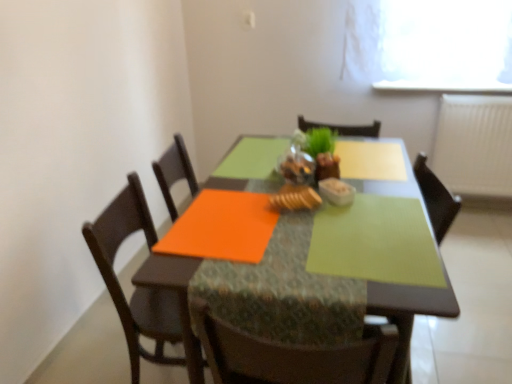
Question: Would you consider wooden chair at left to be distant from baked golden bread at center?

Choices:
 (A) no
 (B) yes

Answer: (A)

Question: Is wooden chair at left oriented towards baked golden bread at center?

Choices:
 (A) yes
 (B) no

Answer: (A)

Question: From the image's perspective, does wooden chair at left appear lower than baked golden bread at center?

Choices:
 (A) yes
 (B) no

Answer: (A)

Question: Can you confirm if wooden chair at left is positioned to the left of baked golden bread at center?

Choices:
 (A) no
 (B) yes

Answer: (B)

Question: From the image's perspective, is wooden chair at left located above baked golden bread at center?

Choices:
 (A) yes
 (B) no

Answer: (B)

Question: In the image, is white textured radiator at right positioned in front of or behind green matte placemat at center?

Choices:
 (A) behind
 (B) front

Answer: (A)

Question: From a real-world perspective, is white textured radiator at right above or below green matte placemat at center?

Choices:
 (A) above
 (B) below

Answer: (A)

Question: In terms of height, does white textured radiator at right look taller or shorter compared to green matte placemat at center?

Choices:
 (A) tall
 (B) short

Answer: (B)

Question: Based on their sizes in the image, would you say white textured radiator at right is bigger or smaller than green matte placemat at center?

Choices:
 (A) small
 (B) big

Answer: (A)

Question: Is green matte placemat at center inside the boundaries of white textured radiator at right, or outside?

Choices:
 (A) outside
 (B) inside

Answer: (A)

Question: Is green matte placemat at center bigger or smaller than white textured radiator at right?

Choices:
 (A) small
 (B) big

Answer: (B)

Question: Is point (384, 309) closer or farther from the camera than point (446, 142)?

Choices:
 (A) closer
 (B) farther

Answer: (A)

Question: Considering the positions of green matte placemat at center and white textured radiator at right in the image, is green matte placemat at center taller or shorter than white textured radiator at right?

Choices:
 (A) tall
 (B) short

Answer: (A)

Question: From a real-world perspective, is matte glass table at center positioned above or below green matte houseplant at center?

Choices:
 (A) below
 (B) above

Answer: (A)

Question: From the image's perspective, relative to green matte houseplant at center, is matte glass table at center above or below?

Choices:
 (A) above
 (B) below

Answer: (B)